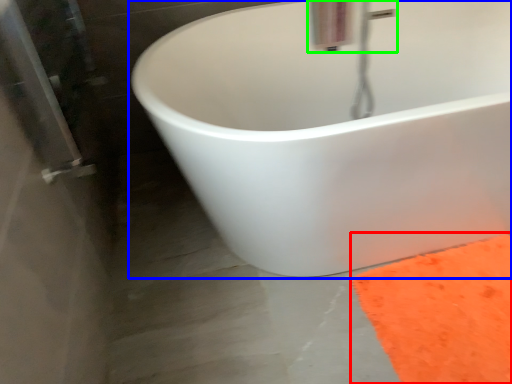
Question: Which is farther away from doormat (highlighted by a red box)? bathtub (highlighted by a blue box) or plumbing fixture (highlighted by a green box)?

Choices:
 (A) bathtub
 (B) plumbing fixture

Answer: (B)